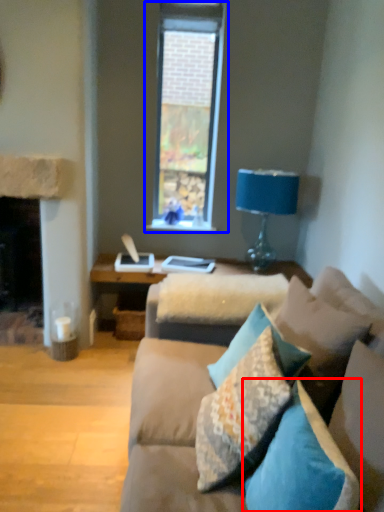
Question: Among these objects, which one is nearest to the camera, pillow (highlighted by a red box) or window (highlighted by a blue box)?

Choices:
 (A) pillow
 (B) window

Answer: (A)